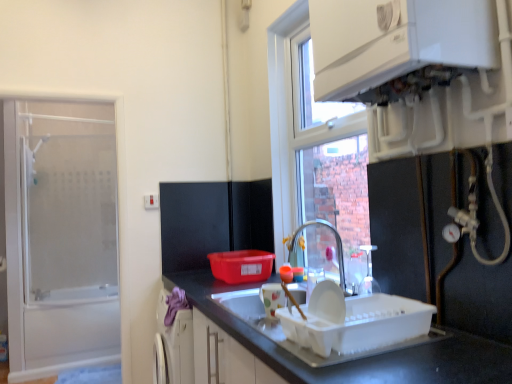
Question: From the image's perspective, is white glossy boiler at upper right beneath transparent glass shower door at left?

Choices:
 (A) yes
 (B) no

Answer: (B)

Question: From the image's perspective, is white glossy boiler at upper right on transparent glass shower door at left?

Choices:
 (A) no
 (B) yes

Answer: (B)

Question: Is white glossy boiler at upper right positioned beyond the bounds of transparent glass shower door at left?

Choices:
 (A) yes
 (B) no

Answer: (A)

Question: Is the position of white glossy boiler at upper right more distant than that of transparent glass shower door at left?

Choices:
 (A) yes
 (B) no

Answer: (B)

Question: Is transparent glass shower door at left at the back of white glossy boiler at upper right?

Choices:
 (A) yes
 (B) no

Answer: (B)

Question: Considering the positions of glossy metallic tap at center and white glossy boiler at upper right in the image, is glossy metallic tap at center taller or shorter than white glossy boiler at upper right?

Choices:
 (A) short
 (B) tall

Answer: (A)

Question: Looking at their shapes, would you say glossy metallic tap at center is wider or thinner than white glossy boiler at upper right?

Choices:
 (A) wide
 (B) thin

Answer: (B)

Question: From the image's perspective, is glossy metallic tap at center above or below white glossy boiler at upper right?

Choices:
 (A) above
 (B) below

Answer: (B)

Question: From a real-world perspective, is glossy metallic tap at center physically located above or below white glossy boiler at upper right?

Choices:
 (A) below
 (B) above

Answer: (A)

Question: From the image's perspective, is glossy metallic tap at center located above or below white glossy countertop at lower center?

Choices:
 (A) above
 (B) below

Answer: (A)

Question: Does point (333, 231) appear closer or farther from the camera than point (472, 360)?

Choices:
 (A) farther
 (B) closer

Answer: (A)

Question: Is glossy metallic tap at center situated inside white glossy countertop at lower center or outside?

Choices:
 (A) outside
 (B) inside

Answer: (A)

Question: Looking at the image, does glossy metallic tap at center seem bigger or smaller compared to white glossy countertop at lower center?

Choices:
 (A) big
 (B) small

Answer: (B)

Question: Considering their positions, is transparent glass shower door at left located in front of or behind white glossy countertop at lower center?

Choices:
 (A) behind
 (B) front

Answer: (A)

Question: Would you say transparent glass shower door at left is inside or outside white glossy countertop at lower center?

Choices:
 (A) outside
 (B) inside

Answer: (A)